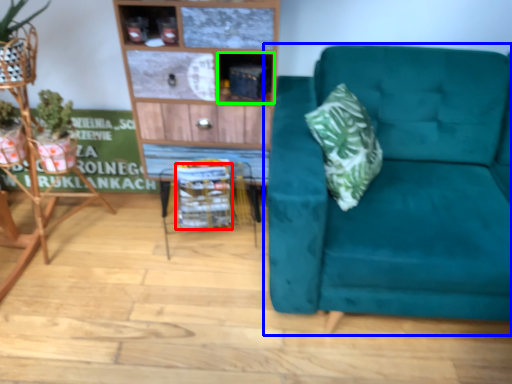
Question: Which object is the farthest from basket (highlighted by a red box)? Choose among these: studio couch (highlighted by a blue box) or cabinet (highlighted by a green box).

Choices:
 (A) studio couch
 (B) cabinet

Answer: (A)